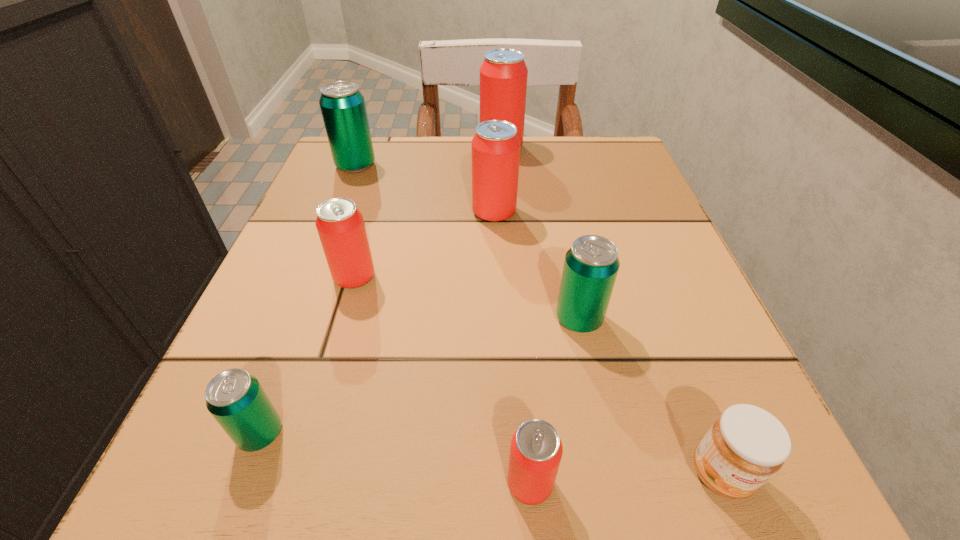
You are a GUI agent. You are given a task and a screenshot of the screen. Output one action in this format:
    pyautogui.click(x=<x>, y=<y>)
    Task: Click on the teal beer can that stands as the third closest to the third farthest red beer can
    
    Given the screenshot: What is the action you would take?
    pyautogui.click(x=591, y=265)

Where is `vacant position in the image that satisfies the following two spatial constraints: 1. on the front side of the smallest red beer can; 2. on the right side of the second smallest red beer can`? The height and width of the screenshot is (540, 960). vacant position in the image that satisfies the following two spatial constraints: 1. on the front side of the smallest red beer can; 2. on the right side of the second smallest red beer can is located at coordinates (294, 483).

At what (x,y) coordinates should I click in order to perform the action: click on free point that satisfies the following two spatial constraints: 1. on the front side of the fourth farthest object; 2. on the left side of the second nearest teal beer can. Please return your answer as a coordinate pair (x, y). This screenshot has height=540, width=960. Looking at the image, I should click on (343, 319).

This screenshot has width=960, height=540. I want to click on free space that satisfies the following two spatial constraints: 1. on the front side of the farthest teal beer can; 2. on the right side of the smallest red beer can, so click(x=230, y=483).